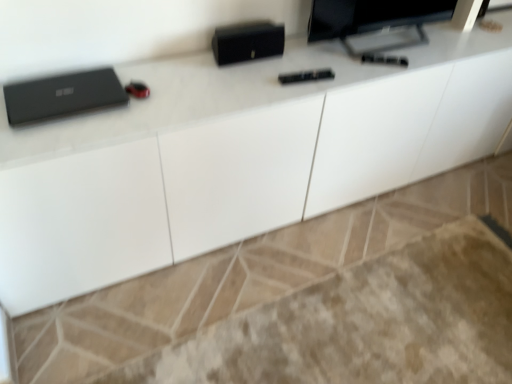
Question: Is matte black monitor at upper right to the left of matte black laptop at left from the viewer's perspective?

Choices:
 (A) no
 (B) yes

Answer: (A)

Question: Does matte black monitor at upper right have a greater height compared to matte black laptop at left?

Choices:
 (A) yes
 (B) no

Answer: (A)

Question: Can you confirm if matte black monitor at upper right is shorter than matte black laptop at left?

Choices:
 (A) yes
 (B) no

Answer: (B)

Question: Is matte black monitor at upper right facing towards matte black laptop at left?

Choices:
 (A) yes
 (B) no

Answer: (B)

Question: Is matte black monitor at upper right positioned with its back to matte black laptop at left?

Choices:
 (A) no
 (B) yes

Answer: (A)

Question: From a real-world perspective, is matte black monitor at upper right on top of matte black laptop at left?

Choices:
 (A) yes
 (B) no

Answer: (A)

Question: Could you tell me if matte black laptop at left is facing matte black monitor at upper right?

Choices:
 (A) no
 (B) yes

Answer: (A)

Question: Is matte black laptop at left looking in the opposite direction of matte black monitor at upper right?

Choices:
 (A) yes
 (B) no

Answer: (B)

Question: From a real-world perspective, is matte black laptop at left on matte black monitor at upper right?

Choices:
 (A) no
 (B) yes

Answer: (A)

Question: Is matte black laptop at left touching matte black monitor at upper right?

Choices:
 (A) no
 (B) yes

Answer: (A)

Question: From a real-world perspective, is matte black laptop at left below matte black monitor at upper right?

Choices:
 (A) yes
 (B) no

Answer: (A)

Question: Is matte black laptop at left thinner than matte black monitor at upper right?

Choices:
 (A) yes
 (B) no

Answer: (B)

Question: Considering the positions of matte black monitor at upper right and matte black laptop at left in the image, is matte black monitor at upper right taller or shorter than matte black laptop at left?

Choices:
 (A) tall
 (B) short

Answer: (A)